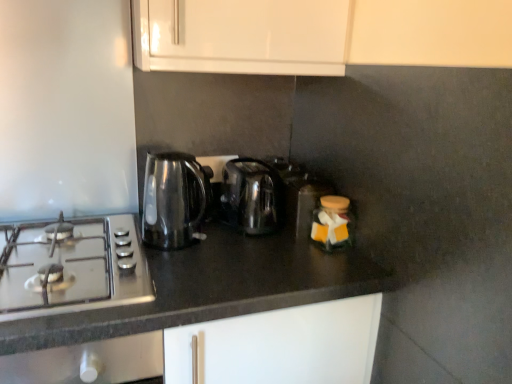
Locate an element on the screen. The height and width of the screenshot is (384, 512). free space in front of matte glass jar at center right, marked as the 1th appliance in a front-to-back arrangement is located at coordinates (329, 267).